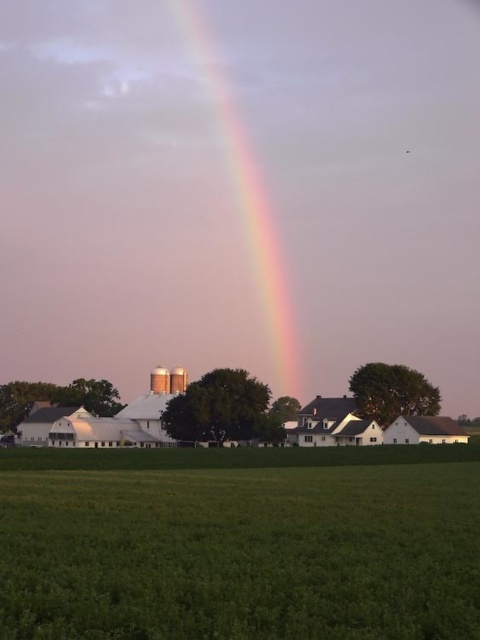
From the picture: Does green grass at lower center have a lesser width compared to rainbow at center?

Yes, green grass at lower center is thinner than rainbow at center.

Where is `green grass at lower center`? green grass at lower center is located at coordinates (240, 544).